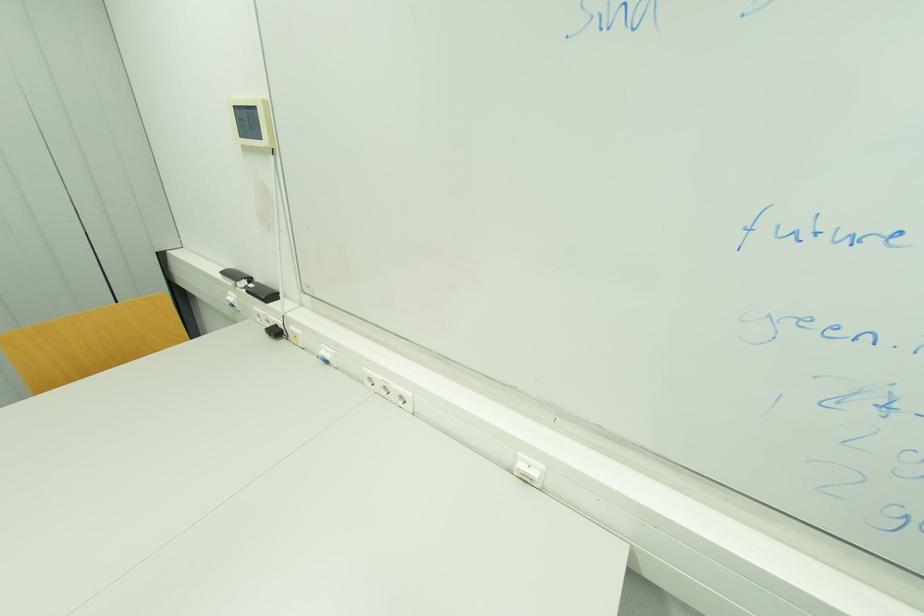
This screenshot has height=616, width=924. What do you see at coordinates (528, 469) in the screenshot?
I see `the white network socket` at bounding box center [528, 469].